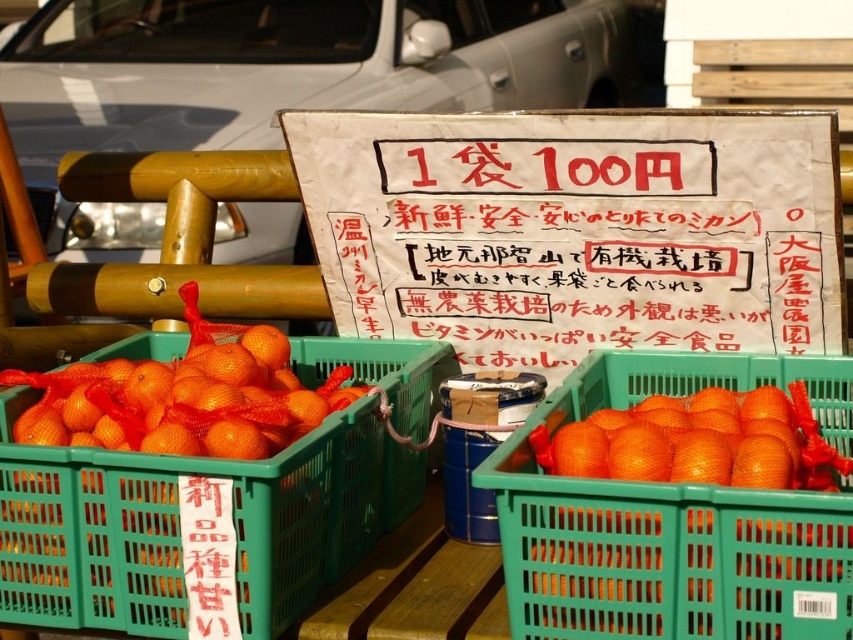
Question: Can you confirm if orange mesh bag at center is positioned below orange mesh basket at center?

Choices:
 (A) yes
 (B) no

Answer: (B)

Question: Can you confirm if orange mesh bag at center is positioned to the right of orange mesh basket at center?

Choices:
 (A) no
 (B) yes

Answer: (A)

Question: Which point is closer to the camera?

Choices:
 (A) orange mesh basket at center
 (B) orange mesh bag at center

Answer: (A)

Question: Does orange mesh bag at center have a larger size compared to orange mesh basket at center?

Choices:
 (A) no
 (B) yes

Answer: (B)